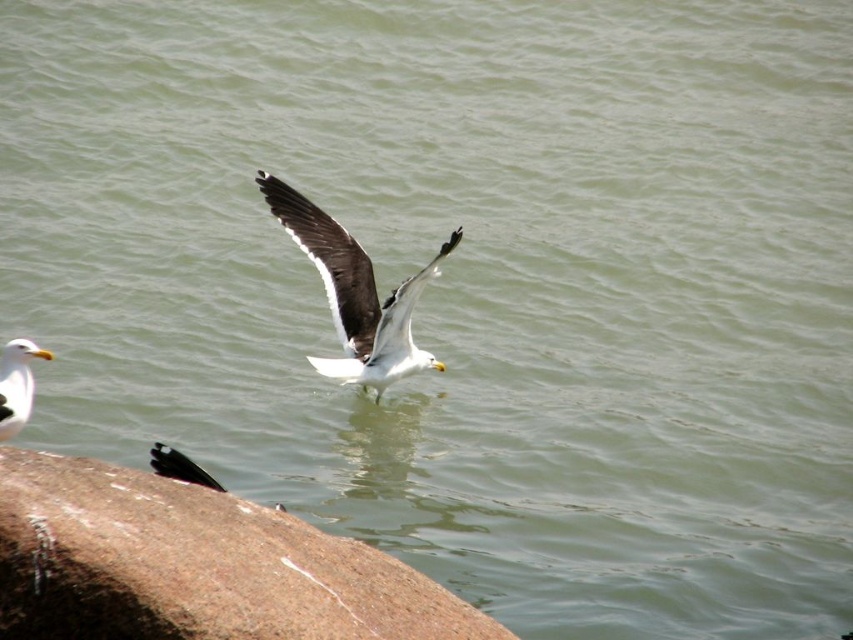
Question: Which is nearer to the white matte seagull at center?

Choices:
 (A) brown granite rock at lower left
 (B) white matte seagull at lower left

Answer: (B)

Question: Which object is farther from the camera taking this photo?

Choices:
 (A) brown granite rock at lower left
 (B) white matte seagull at center
 (C) white matte seagull at lower left

Answer: (B)

Question: Can you confirm if white matte seagull at center is positioned to the left of white matte seagull at lower left?

Choices:
 (A) no
 (B) yes

Answer: (A)

Question: Considering the real-world distances, which object is farthest from the white matte seagull at center?

Choices:
 (A) brown granite rock at lower left
 (B) white matte seagull at lower left

Answer: (A)

Question: Considering the relative positions of brown granite rock at lower left and white matte seagull at center in the image provided, where is brown granite rock at lower left located with respect to white matte seagull at center?

Choices:
 (A) below
 (B) above

Answer: (A)

Question: Does brown granite rock at lower left appear under white matte seagull at lower left?

Choices:
 (A) no
 (B) yes

Answer: (B)